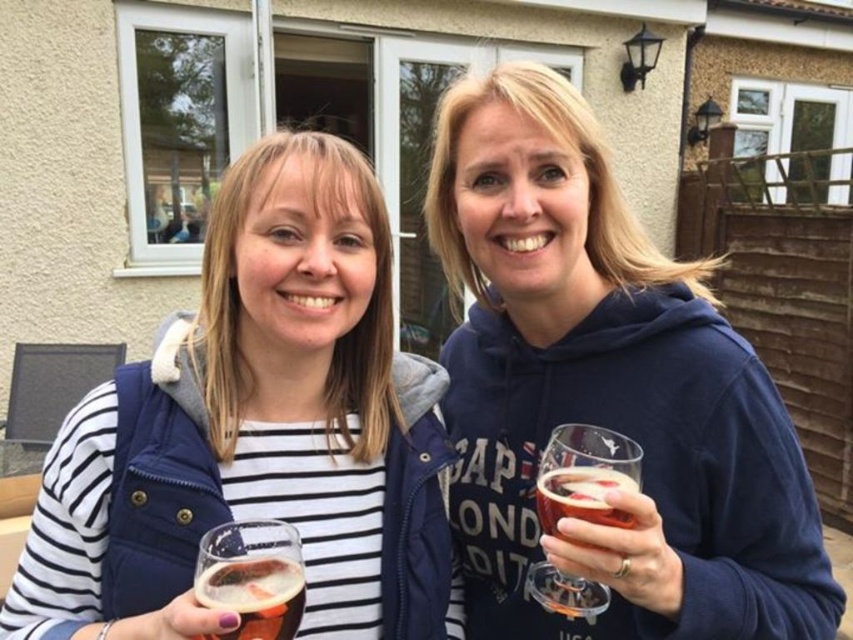
Question: Is white striped shirt at center thinner than translucent glass beer at center?

Choices:
 (A) no
 (B) yes

Answer: (A)

Question: Which point is farther to the camera?

Choices:
 (A) white striped shirt at center
 (B) blue cotton hoodie at center

Answer: (B)

Question: Does blue cotton hoodie at center come in front of white striped shirt at center?

Choices:
 (A) no
 (B) yes

Answer: (A)

Question: Does blue cotton hoodie at center appear over white striped shirt at center?

Choices:
 (A) no
 (B) yes

Answer: (B)

Question: Estimate the real-world distances between objects in this image. Which object is closer to the blue cotton hoodie at center?

Choices:
 (A) translucent glass beer at center
 (B) translucent glass at right
 (C) white striped shirt at center

Answer: (B)

Question: Which point is closer to the camera?

Choices:
 (A) translucent glass beer at center
 (B) translucent glass at right
 (C) blue cotton hoodie at center
 (D) white striped shirt at center

Answer: (D)